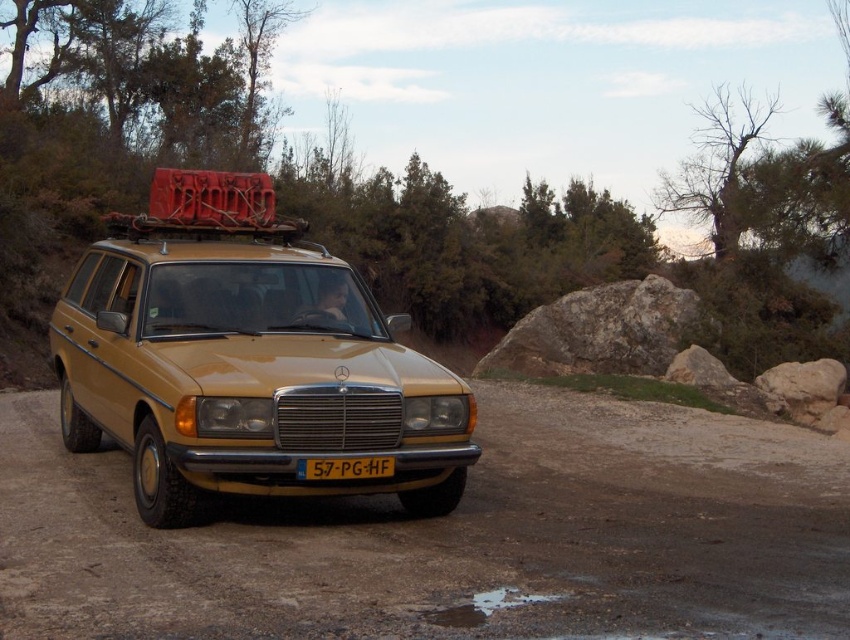
You are driving a matte yellow car at center and need to stay within the dull yellow dirt track at center. Based on their widths, is this feasible?

The dull yellow dirt track at center has a lesser width compared to matte yellow car at center, so it is not feasible to drive the matte yellow car at center while staying entirely within the dull yellow dirt track at center.

You are standing at the back of the vintage Mercedes station wagon and want to walk to the point marked as point [333,477]. However, there is an obstacle at point [638,576]. Will you encounter this obstacle on your way?

Yes, you will encounter the obstacle at point [638,576] because it is in front of point [333,477], meaning it lies along the path towards that destination.